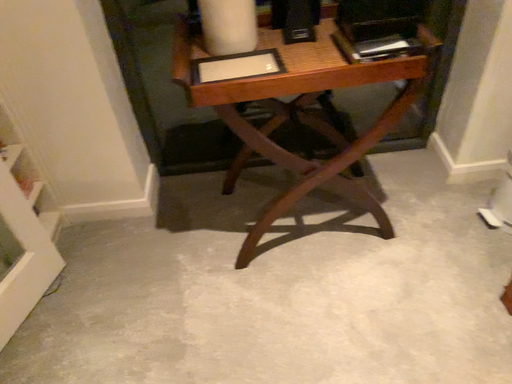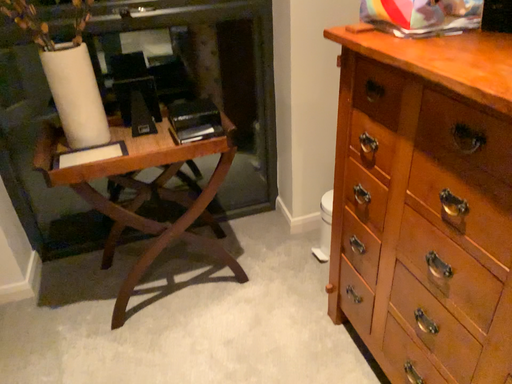
Question: Which way did the camera rotate in the video?

Choices:
 (A) rotated right
 (B) rotated left

Answer: (A)